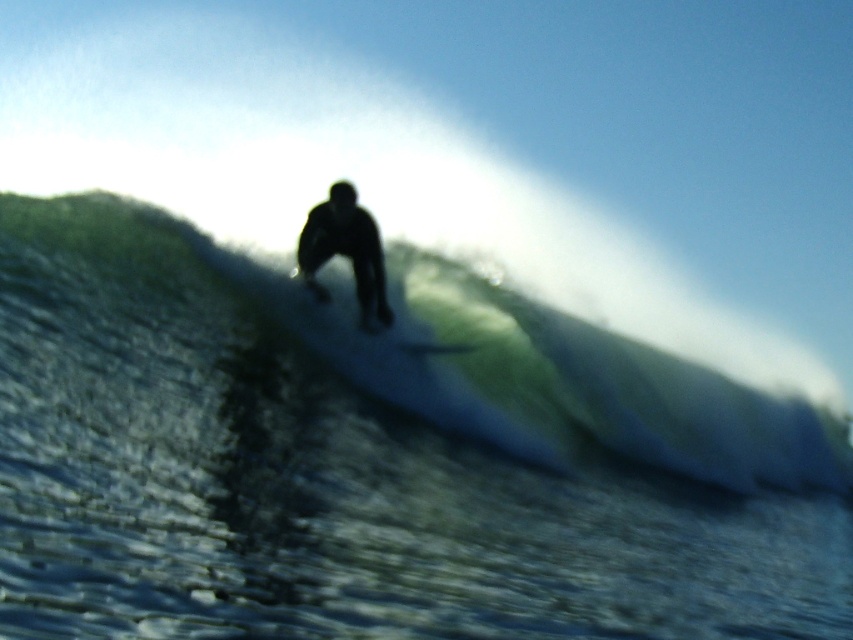
You are a photographer trying to capture the surfer with both the black matte surfboard at center and the smooth white surfboard at center. Which surfboard will appear larger in your photo?

The black matte surfboard at center is much taller than the smooth white surfboard at center, so it will appear larger in the photo.

From the picture: You are a surfer who wants to choose a surfboard that is wider to catch waves easily. Based on the image, which surfboard should you pick between the green rubber surfboard at center and the smooth white surfboard at center?

The green rubber surfboard at center is wider than the smooth white surfboard at center, so you should pick the green rubber surfboard at center to catch waves easily.